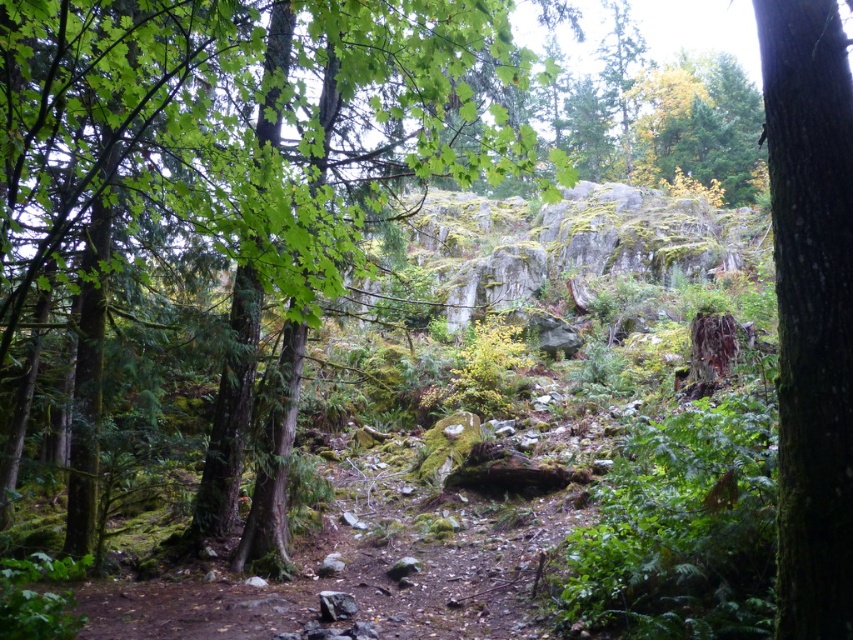
Question: Can you confirm if green mossy tree at center is positioned above green mossy bark tree at right?

Choices:
 (A) yes
 (B) no

Answer: (A)

Question: Is green mossy tree at center below green mossy bark tree at right?

Choices:
 (A) no
 (B) yes

Answer: (A)

Question: Is green mossy tree at center above green mossy bark tree at right?

Choices:
 (A) yes
 (B) no

Answer: (A)

Question: Which of the following is the farthest from the observer?

Choices:
 (A) (236, 72)
 (B) (809, 0)

Answer: (A)